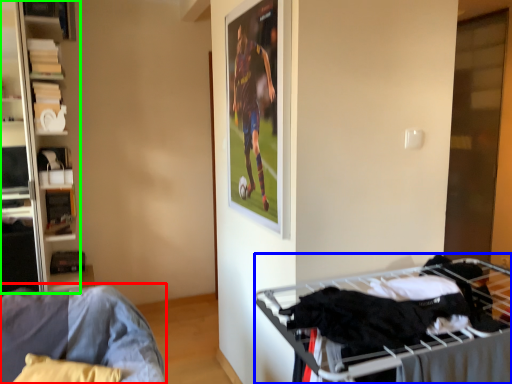
Question: Which object is positioned closest to furniture (highlighted by a red box)? Select from bunk bed (highlighted by a blue box) and shelf (highlighted by a green box).

Choices:
 (A) bunk bed
 (B) shelf

Answer: (A)